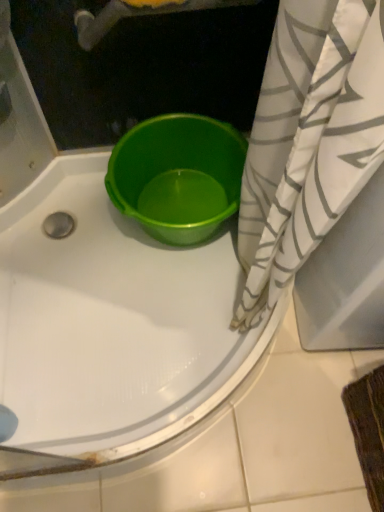
Question: Can you confirm if white/gray striped fabric at right is thinner than matte green tub at center?

Choices:
 (A) yes
 (B) no

Answer: (A)

Question: From the image's perspective, is white/gray striped fabric at right under matte green tub at center?

Choices:
 (A) no
 (B) yes

Answer: (B)

Question: Is white/gray striped fabric at right further to camera compared to matte green tub at center?

Choices:
 (A) no
 (B) yes

Answer: (B)

Question: Would you say white/gray striped fabric at right is outside matte green tub at center?

Choices:
 (A) no
 (B) yes

Answer: (B)

Question: Is white/gray striped fabric at right not close to matte green tub at center?

Choices:
 (A) no
 (B) yes

Answer: (A)

Question: Does white/gray striped fabric at right lie in front of matte green tub at center?

Choices:
 (A) yes
 (B) no

Answer: (B)

Question: Is matte green tub at center facing towards white/gray striped fabric at right?

Choices:
 (A) yes
 (B) no

Answer: (B)

Question: From a real-world perspective, is matte green tub at center located beneath white/gray striped fabric at right?

Choices:
 (A) no
 (B) yes

Answer: (A)

Question: From the image's perspective, is matte green tub at center beneath white/gray striped fabric at right?

Choices:
 (A) no
 (B) yes

Answer: (A)

Question: Is white/gray striped fabric at right completely or partially inside matte green tub at center?

Choices:
 (A) no
 (B) yes

Answer: (A)

Question: Is matte green tub at center outside of white/gray striped fabric at right?

Choices:
 (A) yes
 (B) no

Answer: (A)

Question: Can you confirm if matte green tub at center is wider than white/gray striped fabric at right?

Choices:
 (A) no
 (B) yes

Answer: (B)

Question: Is matte green tub at center at the left side of green plastic bucket at center?

Choices:
 (A) no
 (B) yes

Answer: (B)